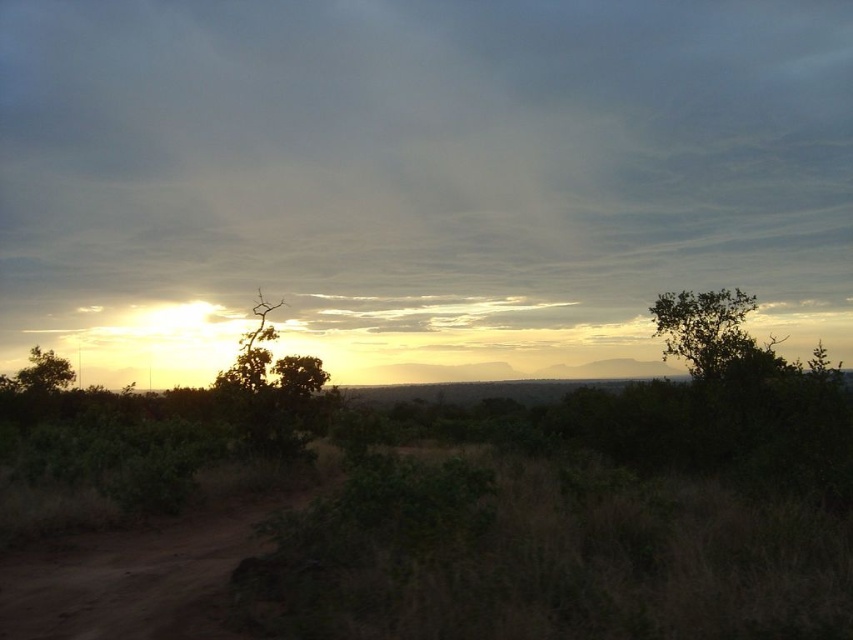
Where is `green leafy tree at right`? The height and width of the screenshot is (640, 853). green leafy tree at right is located at coordinates (704, 328).

Which is behind, point (656, 298) or point (33, 374)?

The point (33, 374) is behind.

Measure the distance between green leafy tree at right and camera.

They are 78.77 feet apart.

This screenshot has width=853, height=640. Identify the location of green leafy tree at right. (704, 328).

Who is higher up, translucent white cloud at upper center or green leafy tree at right?

translucent white cloud at upper center is higher up.

Can you confirm if translucent white cloud at upper center is bigger than green leafy tree at right?

Yes.

Is point (260, 269) closer to viewer compared to point (664, 324)?

No, it is not.

Identify the location of translucent white cloud at upper center. This screenshot has width=853, height=640. (418, 180).

Does translucent white cloud at upper center appear on the left side of brown dirt track at lower left?

In fact, translucent white cloud at upper center is to the right of brown dirt track at lower left.

Is point (144, 300) positioned in front of point (207, 538)?

No, it is not.

At what (x,y) coordinates should I click in order to perform the action: click on translucent white cloud at upper center. Please return your answer as a coordinate pair (x, y). This screenshot has width=853, height=640. Looking at the image, I should click on (418, 180).